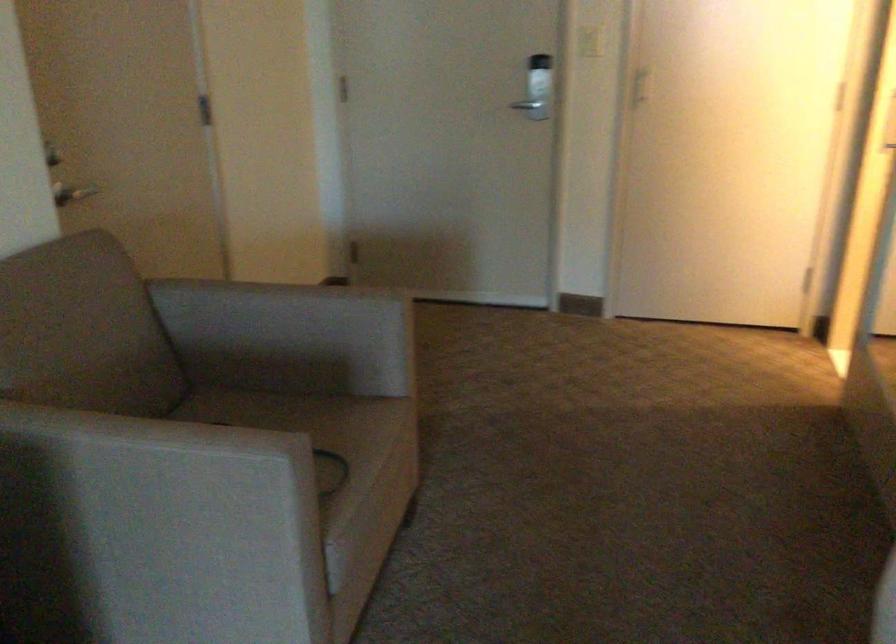
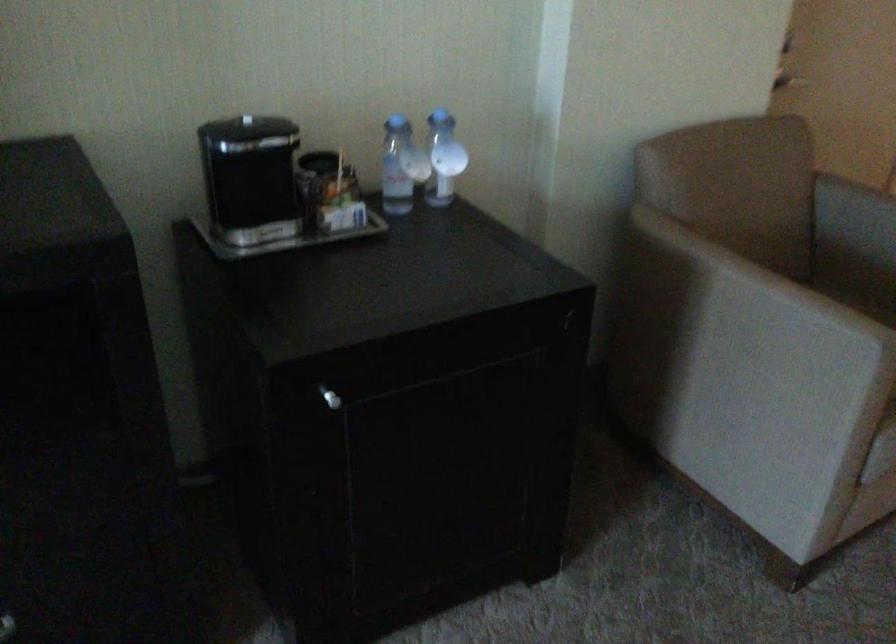
Locate, in the second image, the point that corresponds to (244,410) in the first image.

(859, 303)